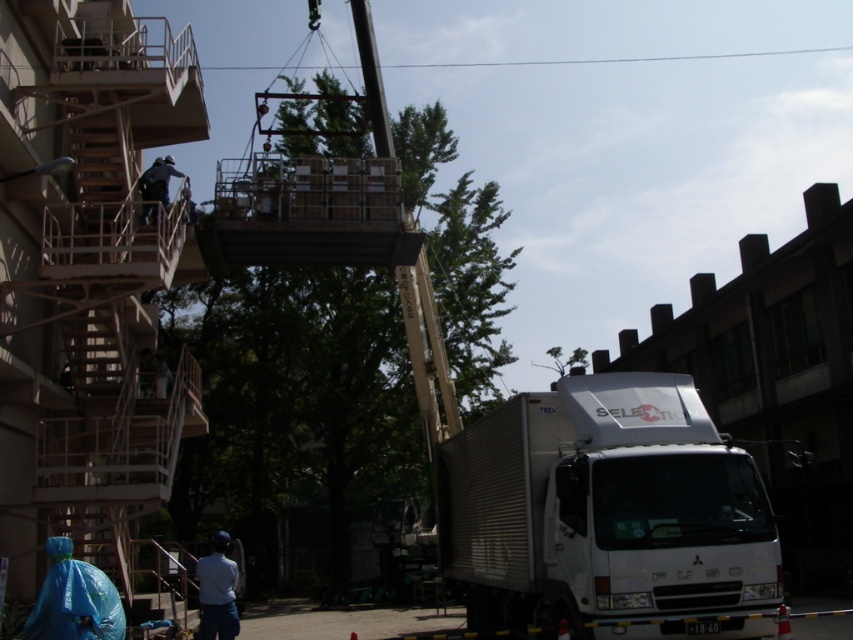
Can you confirm if white metallic truck at lower right is smaller than dark blue uniform at upper left?

Actually, white metallic truck at lower right might be larger than dark blue uniform at upper left.

Which is more to the left, white metallic truck at lower right or dark blue uniform at upper left?

dark blue uniform at upper left is more to the left.

The image size is (853, 640). Identify the location of white metallic truck at lower right. (602, 508).

Image resolution: width=853 pixels, height=640 pixels. Identify the location of white metallic truck at lower right. (602, 508).